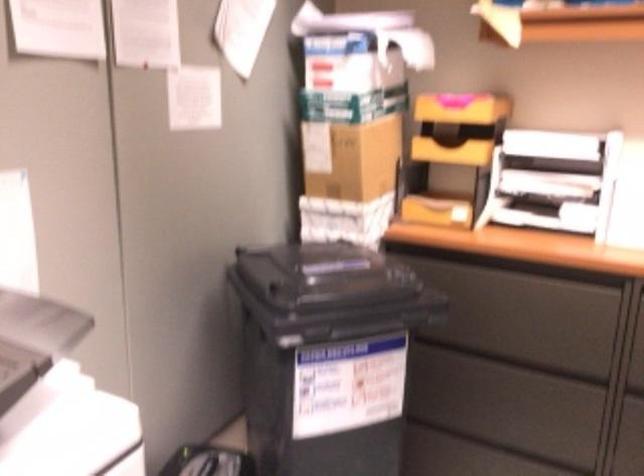
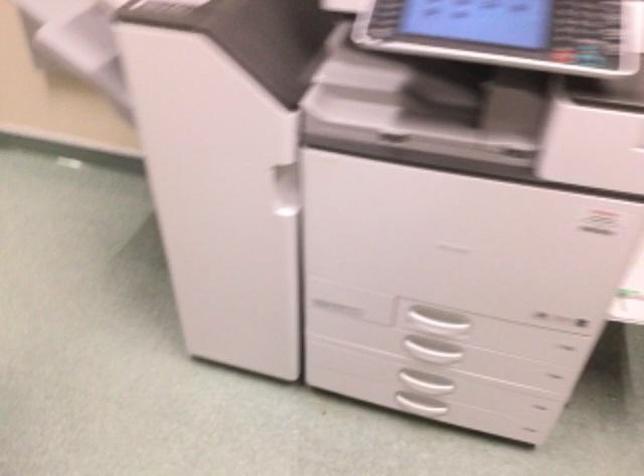
The first image is from the beginning of the video and the second image is from the end. How did the camera likely rotate when shooting the video?

The camera's rotation is toward left-down.